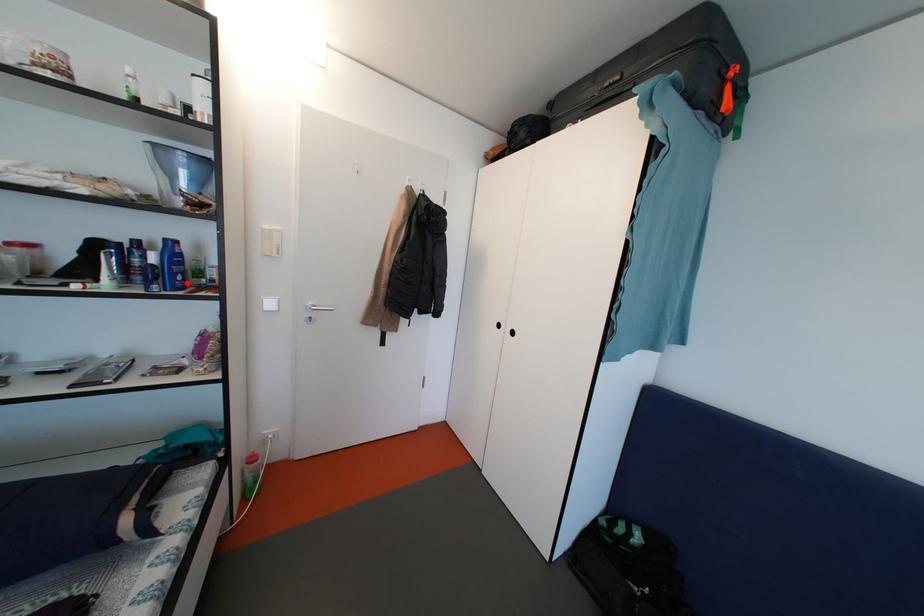
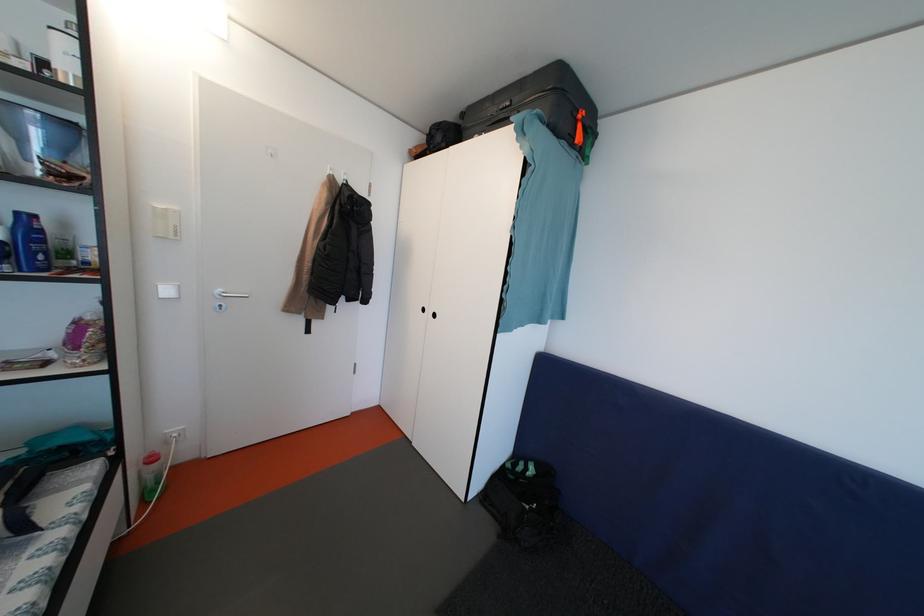
In the second image, find the point that corresponds to the highlighted location in the first image.

(49, 262)